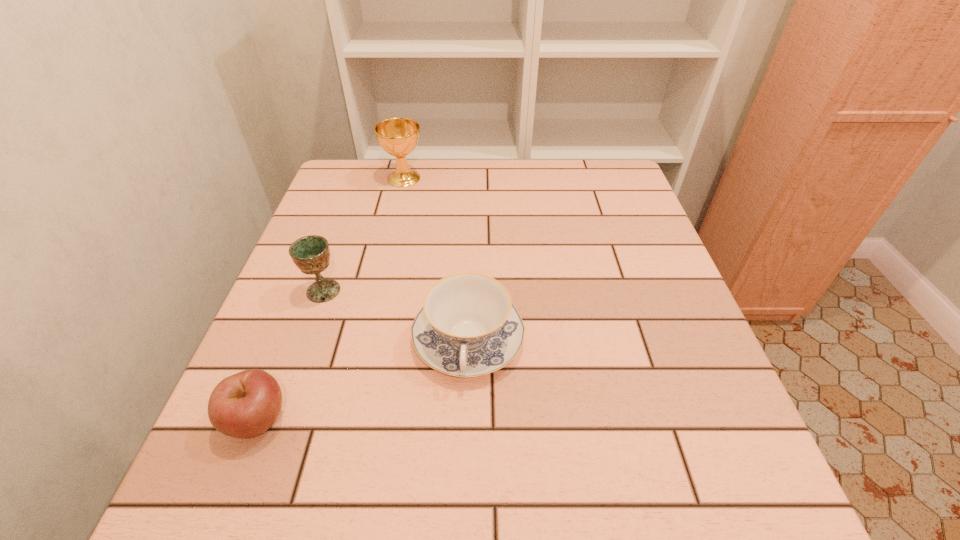
Find the location of `free spot located 0.180m on the side of the nearest object with the unique marking`. free spot located 0.180m on the side of the nearest object with the unique marking is located at coordinates (399, 419).

The width and height of the screenshot is (960, 540). I want to click on object that is positioned at the far edge, so click(398, 137).

Locate an element on the screen. The image size is (960, 540). apple present at the left edge is located at coordinates (244, 405).

Find the location of a particular element. This screenshot has height=540, width=960. object that is at the far left corner is located at coordinates (398, 137).

You are a GUI agent. You are given a task and a screenshot of the screen. Output one action in this format:
    pyautogui.click(x=<x>, y=<y>)
    Task: Click on the free space at the far edge
    
    Given the screenshot: What is the action you would take?
    [431, 184]

This screenshot has width=960, height=540. In the image, there is a desktop. What are the coordinates of `vacant space at the left edge` in the screenshot? It's located at (338, 313).

The height and width of the screenshot is (540, 960). Find the location of `free space at the right edge of the desktop`. free space at the right edge of the desktop is located at coordinates (587, 211).

What are the coordinates of `vacant space at the far left corner of the desktop` in the screenshot? It's located at (337, 193).

At what (x,y) coordinates should I click in order to perform the action: click on free space at the near left corner of the desktop. Please return your answer as a coordinate pair (x, y). Looking at the image, I should click on (258, 490).

You are a GUI agent. You are given a task and a screenshot of the screen. Output one action in this format:
    pyautogui.click(x=<x>, y=<y>)
    Task: Click on the free point at the far right corner
    The height and width of the screenshot is (540, 960).
    Given the screenshot: What is the action you would take?
    624,195